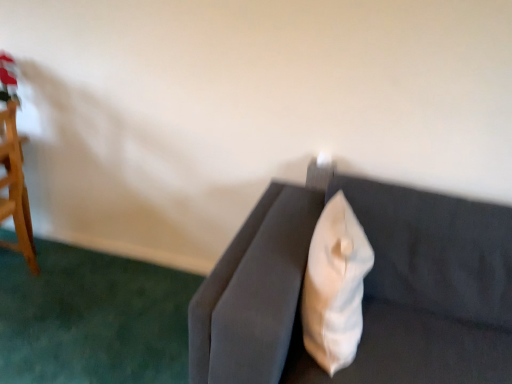
Question: In the image, is velvet gray couch at center positioned in front of or behind white fabric pillow at upper right?

Choices:
 (A) behind
 (B) front

Answer: (B)

Question: Is point (393, 251) closer or farther from the camera than point (330, 331)?

Choices:
 (A) farther
 (B) closer

Answer: (A)

Question: From a real-world perspective, is velvet gray couch at center above or below white fabric pillow at upper right?

Choices:
 (A) above
 (B) below

Answer: (B)

Question: Would you say white fabric pillow at upper right is to the left or to the right of velvet gray couch at center in the picture?

Choices:
 (A) right
 (B) left

Answer: (B)

Question: From a real-world perspective, relative to velvet gray couch at center, is white fabric pillow at upper right vertically above or below?

Choices:
 (A) above
 (B) below

Answer: (A)

Question: From their relative heights in the image, would you say white fabric pillow at upper right is taller or shorter than velvet gray couch at center?

Choices:
 (A) tall
 (B) short

Answer: (B)

Question: In terms of size, does white fabric pillow at upper right appear bigger or smaller than velvet gray couch at center?

Choices:
 (A) big
 (B) small

Answer: (B)